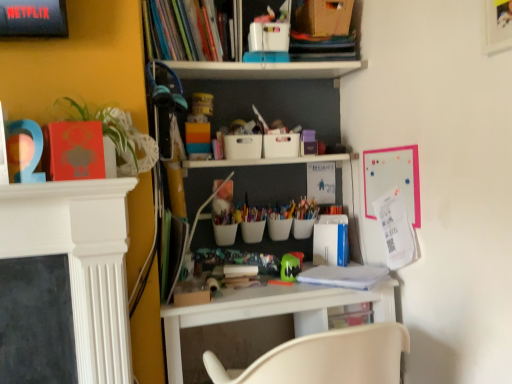
I want to click on free point below white paper at center, which is the second book in top-to-bottom order (from a real-world perspective), so click(345, 276).